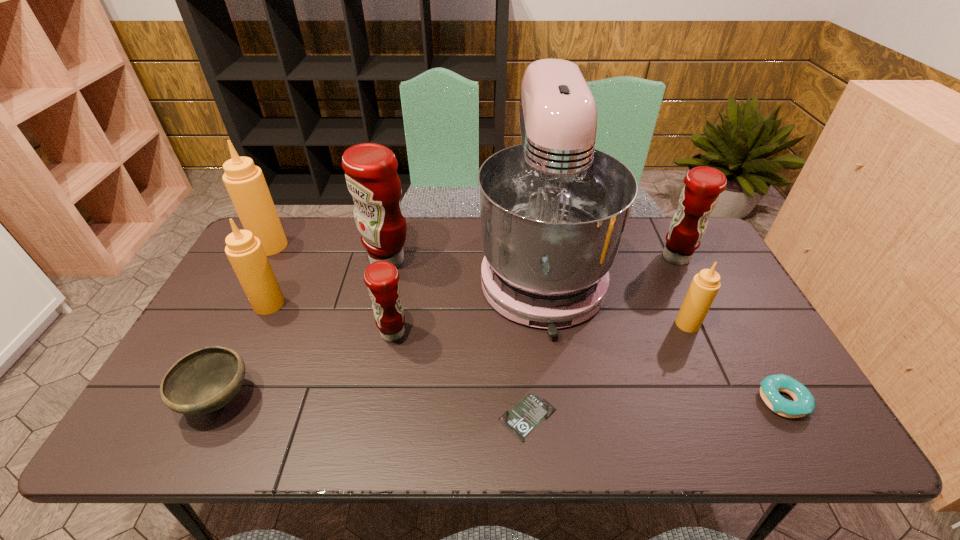
Locate an element on the screen. This screenshot has width=960, height=540. pink mixer is located at coordinates (553, 210).

Find the location of a particular element. the tallest object is located at coordinates (553, 210).

Identify the location of the farthest tan condiment. The width and height of the screenshot is (960, 540). (245, 183).

At what (x,y) coordinates should I click in order to perform the action: click on the biggest red condiment. Please return your answer as a coordinate pair (x, y). The height and width of the screenshot is (540, 960). Looking at the image, I should click on (371, 175).

Find the location of a particular element. Image resolution: width=960 pixels, height=540 pixels. the second biggest red condiment is located at coordinates (703, 185).

This screenshot has height=540, width=960. Find the location of `the second biggest tan condiment`. the second biggest tan condiment is located at coordinates (245, 252).

This screenshot has height=540, width=960. Identify the location of the smallest tan condiment. point(705,285).

I want to click on the nearest red condiment, so coord(381,277).

Where is `the third shortest object`? the third shortest object is located at coordinates (205, 380).

You are a GUI agent. You are given a task and a screenshot of the screen. Output one action in this format:
    pyautogui.click(x=<x>, y=<y>)
    Task: Click on the second shortest object
    The image size is (960, 540).
    Given the screenshot: What is the action you would take?
    pyautogui.click(x=804, y=403)